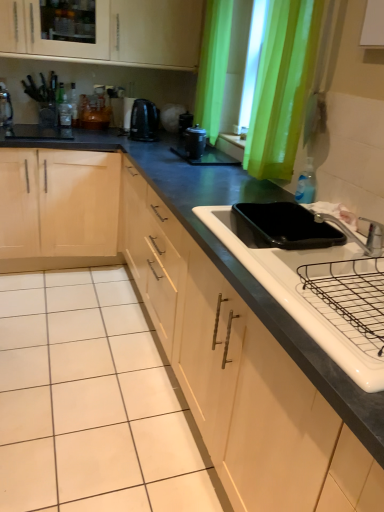
Identify the location of free spot in front of black matte pizza pan at sink. The height and width of the screenshot is (512, 384). (289, 270).